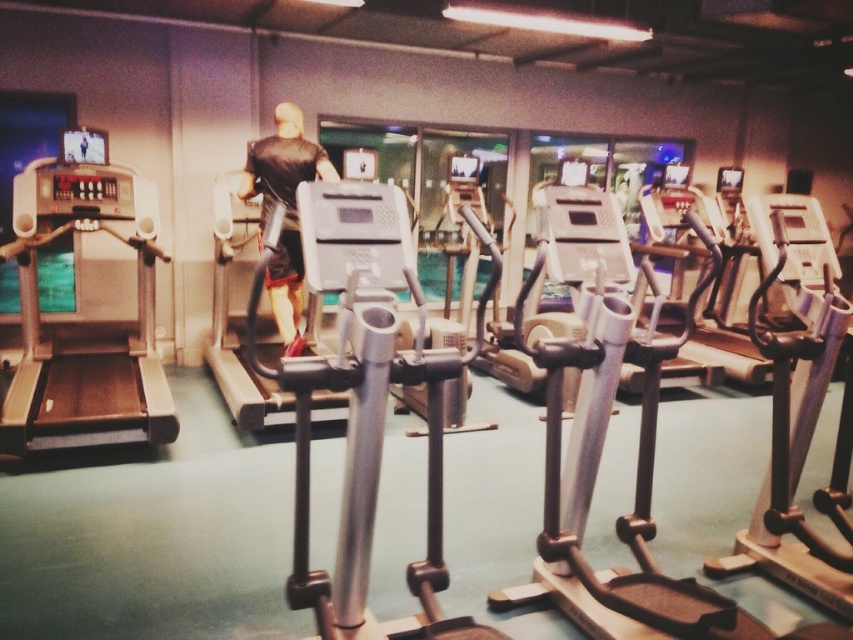
Is silver metallic treadmill at left smaller than silver metallic treadmill at center?

Incorrect, silver metallic treadmill at left is not smaller in size than silver metallic treadmill at center.

Locate an element on the screen. This screenshot has width=853, height=640. silver metallic treadmill at left is located at coordinates (85, 317).

Where is `silver metallic treadmill at left`? This screenshot has width=853, height=640. silver metallic treadmill at left is located at coordinates (85, 317).

Between point (76, 150) and point (248, 426), which one is positioned in front?

Point (248, 426)

Can you confirm if silver metallic treadmill at left is positioned to the left of matte black treadmill at center?

Correct, you'll find silver metallic treadmill at left to the left of matte black treadmill at center.

Between point (25, 428) and point (260, 420), which one is positioned in front?

Point (25, 428)

Find the location of a particular element. The image size is (853, 640). silver metallic treadmill at left is located at coordinates click(85, 317).

Between point (229, 339) and point (698, 200), which one is positioned behind?

Positioned behind is point (698, 200).

Which is more to the right, matte black treadmill at center or silver metallic treadmill at center?

silver metallic treadmill at center is more to the right.

Which is in front, point (225, 308) or point (683, 198)?

Point (225, 308)

The image size is (853, 640). I want to click on matte black treadmill at center, so click(x=236, y=317).